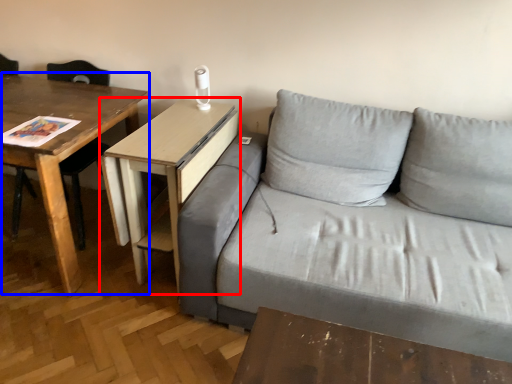
Question: Which object is further to the camera taking this photo, table (highlighted by a red box) or table (highlighted by a blue box)?

Choices:
 (A) table
 (B) table

Answer: (A)